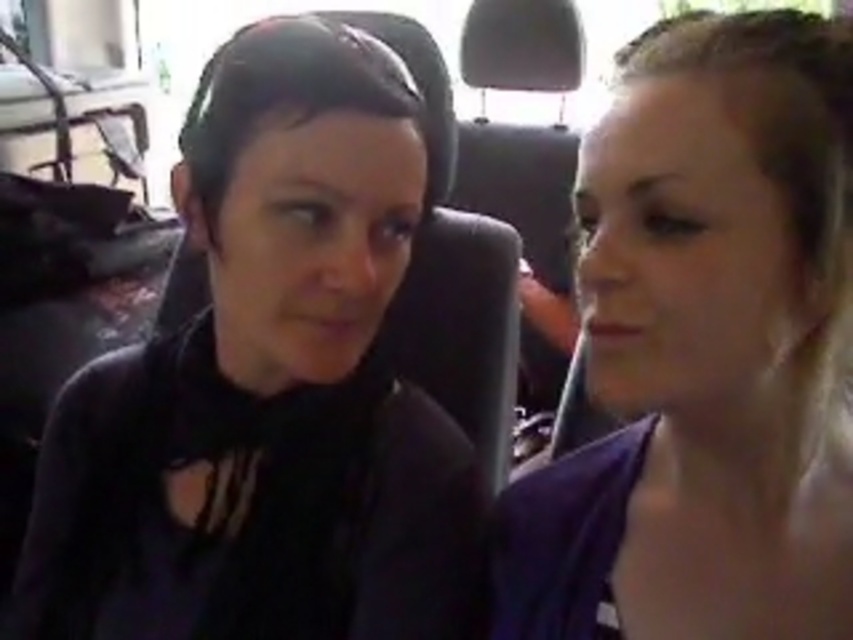
You are a tailor measuring two customers inside a moving car. The customers are wearing the black matte shirt at left and the purple fabric at right. Which customer requires a wider fabric piece for their clothing?

The black matte shirt at left requires a wider fabric piece since its width surpasses that of the purple fabric at right.

What are the coordinates of the black matte shirt at left?

The black matte shirt at left is located at coordinates point (268,387).

You are a photographer trying to capture a closeup of the two people in the vehicle. You want to focus on the point closer to the camera. Which point should you choose between point (350, 161) and point (822, 416)?

Point (350, 161) is further to the camera than point (822, 416), so you should choose point (350, 161) to focus on the closer point.